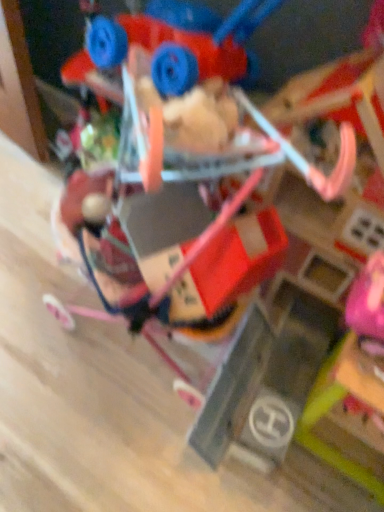
Describe the element at coordinates (180, 182) in the screenshot. The height and width of the screenshot is (512, 384). I see `pink plastic shopping cart at center` at that location.

In order to face pink plastic shopping cart at center, should I rotate leftwards or rightwards?

You should rotate left by 0.170 degrees.

Locate an element on the screen. pink plastic shopping cart at center is located at coordinates (180, 182).

You are a GUI agent. You are given a task and a screenshot of the screen. Output one action in this format:
    pyautogui.click(x=<x>, y=<y>)
    Task: Click on the pink plastic shopping cart at center
    
    Given the screenshot: What is the action you would take?
    pyautogui.click(x=180, y=182)